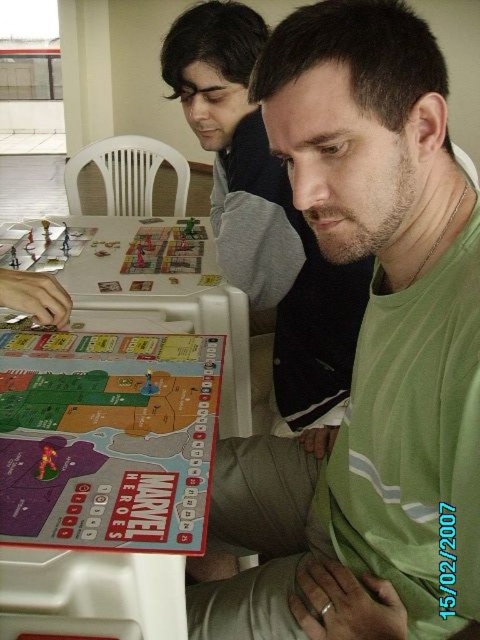
This screenshot has width=480, height=640. Describe the element at coordinates (367, 353) in the screenshot. I see `green matte shirt at center` at that location.

Image resolution: width=480 pixels, height=640 pixels. I want to click on green matte shirt at center, so click(x=367, y=353).

Image resolution: width=480 pixels, height=640 pixels. What do you see at coordinates (367, 353) in the screenshot?
I see `green matte shirt at center` at bounding box center [367, 353].

Locate an element on the screen. The image size is (480, 640). green matte shirt at center is located at coordinates (367, 353).

Is matte plastic board game at center positioned at the back of matte plastic board game at left?

No, matte plastic board game at center is closer to the viewer.

Can you confirm if matte plastic board game at center is positioned below matte plastic board game at left?

Yes.

Does point (48, 337) come farther from viewer compared to point (100, 246)?

No.

This screenshot has width=480, height=640. What are the coordinates of `matte plastic board game at center` in the screenshot? It's located at (107, 438).

Who is higher up, green matte shirt at center or matte plastic board game at center?

green matte shirt at center

Is green matte shirt at center positioned before matte plastic board game at center?

Yes, it is in front of matte plastic board game at center.

Between point (396, 365) and point (8, 349), which one is positioned behind?

The point (8, 349) is more distant.

The height and width of the screenshot is (640, 480). I want to click on green matte shirt at center, so click(367, 353).